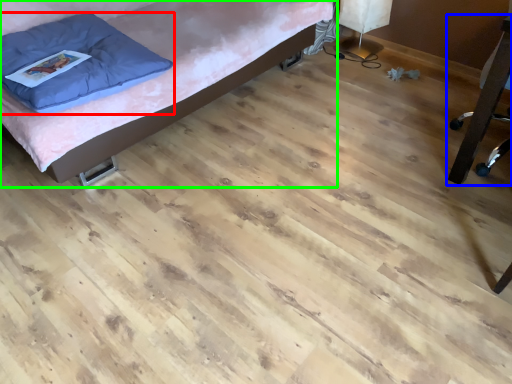
Question: Which object is positioned farthest from pillow (highlighted by a red box)? Select from furniture (highlighted by a blue box) and furniture (highlighted by a green box).

Choices:
 (A) furniture
 (B) furniture

Answer: (A)